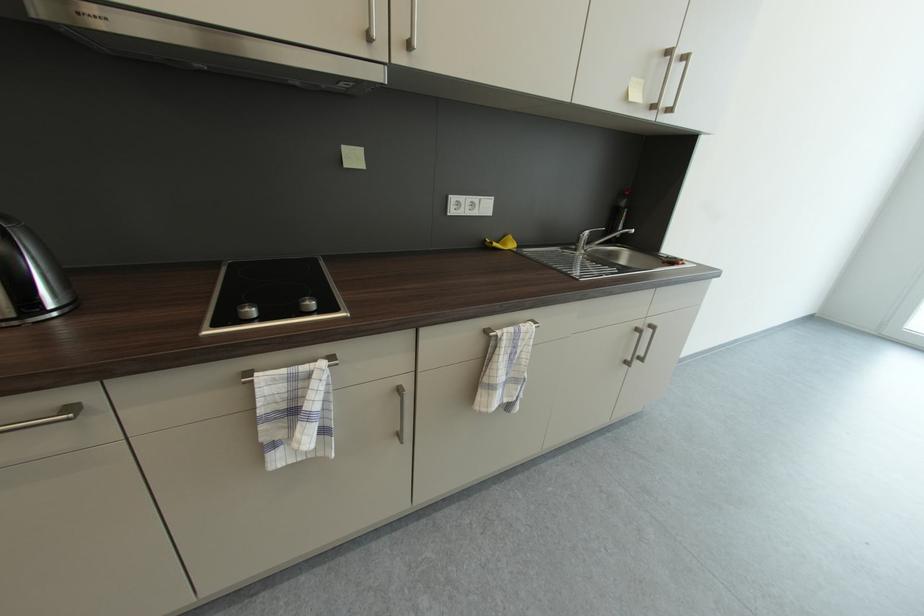
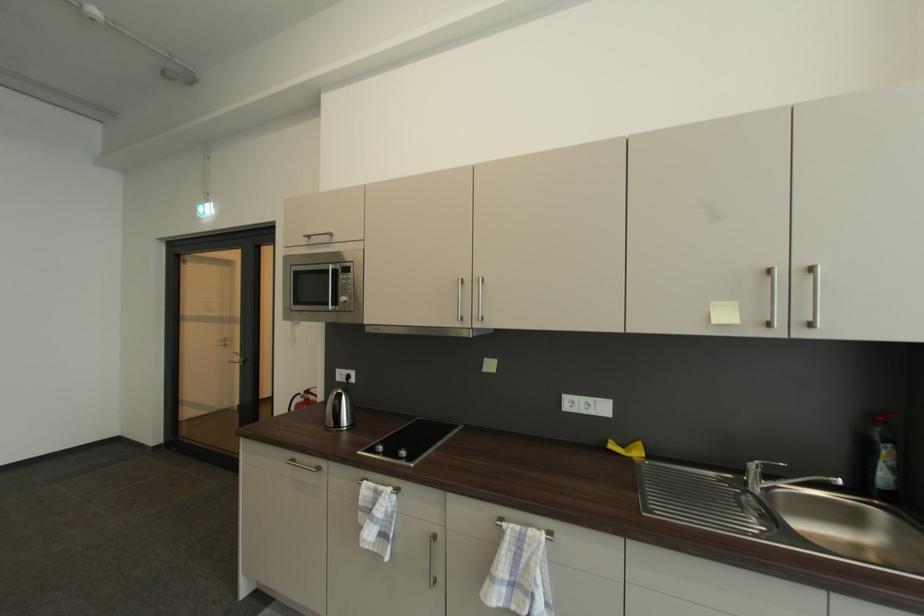
Where in the second image is the point corresponding to the point at 597,233 from the first image?

(769, 466)